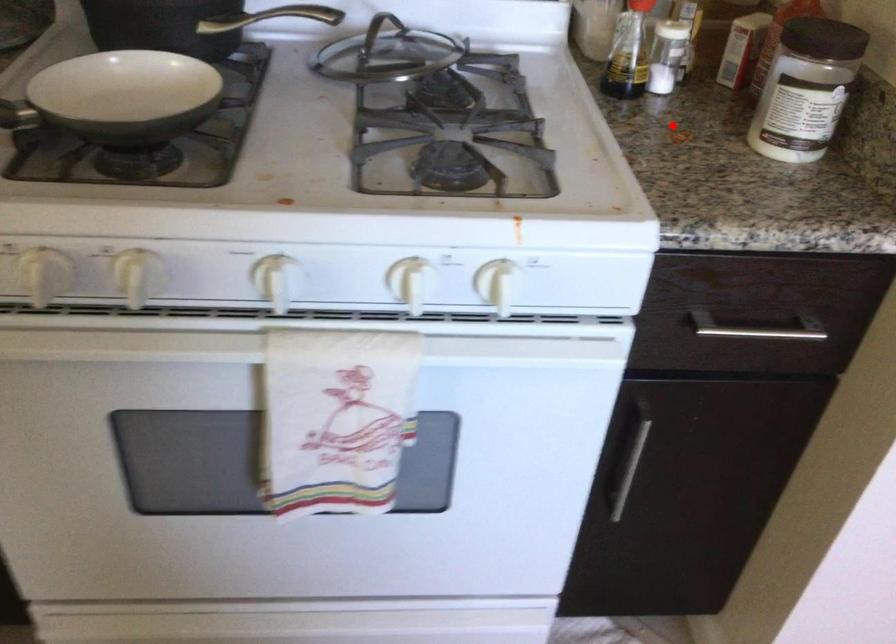
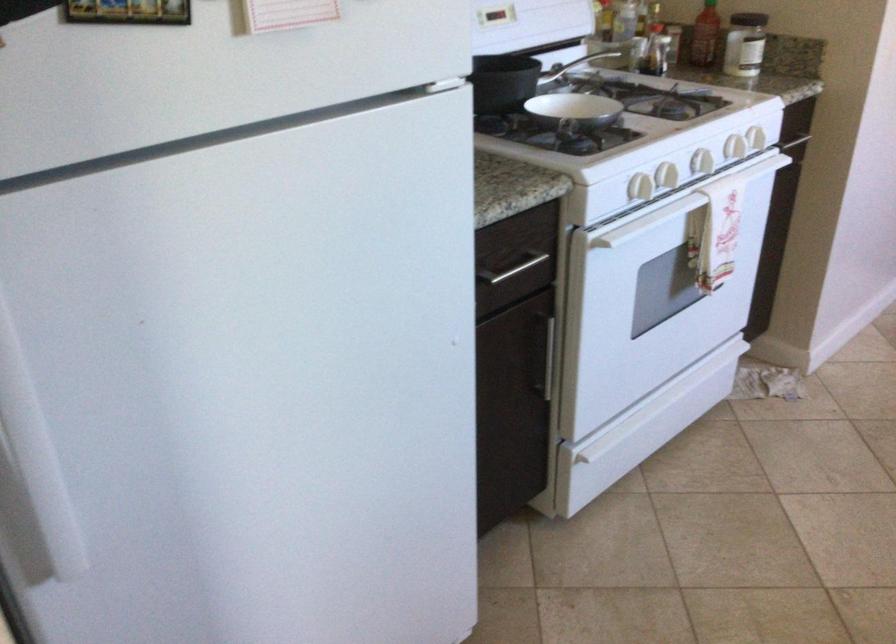
Where in the second image is the point corresponding to the highlighted location from the first image?

(704, 35)